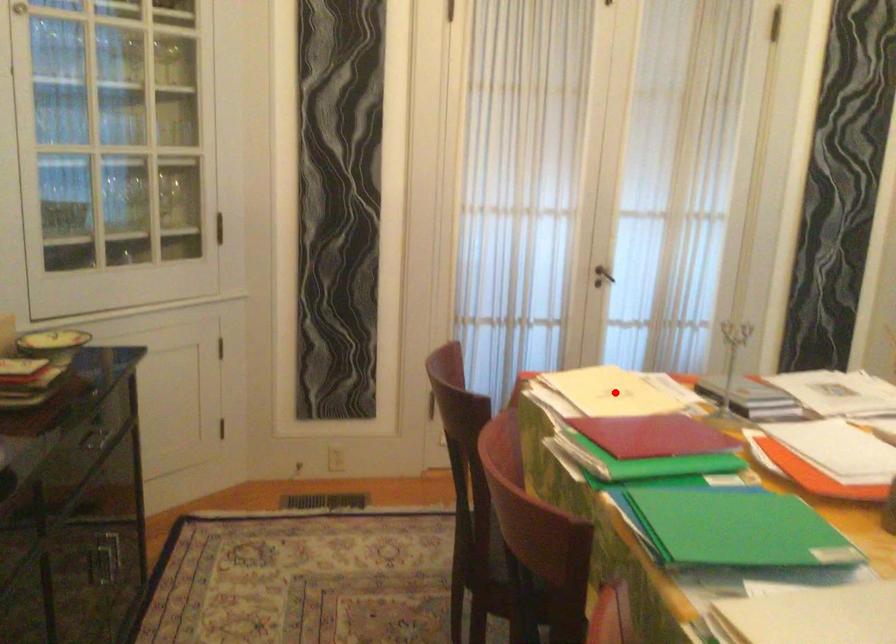
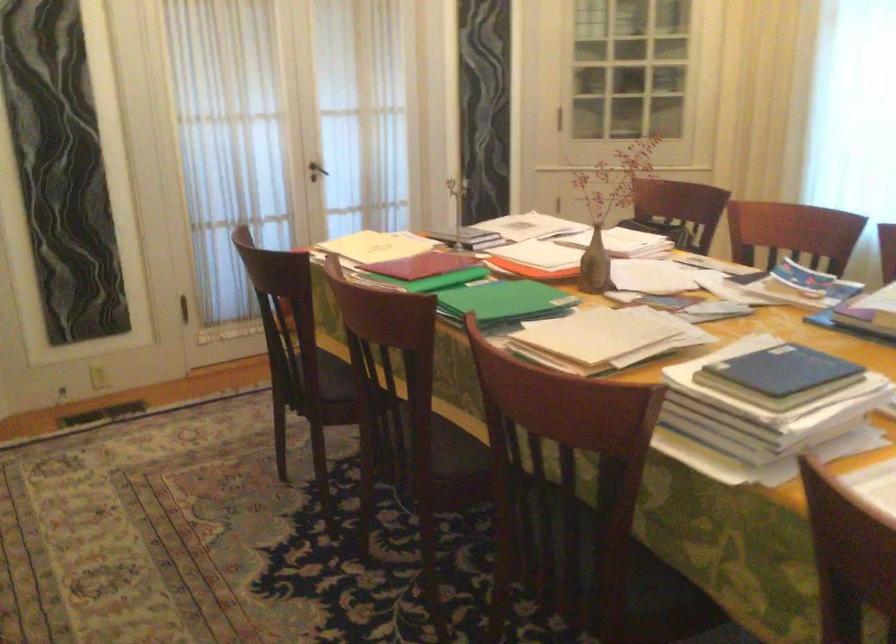
Question: I am providing you with two images of the same scene from different viewpoints. In image1, a red point is highlighted. Considering the same 3D point in image2, which of the following is correct?

Choices:
 (A) It is closer
 (B) It is farther

Answer: (B)